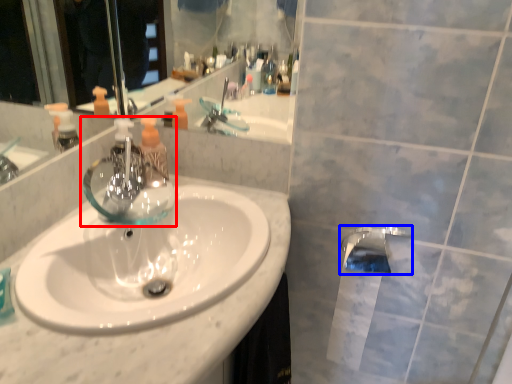
Question: Which point is further to the camera, tap (highlighted by a red box) or tap (highlighted by a blue box)?

Choices:
 (A) tap
 (B) tap

Answer: (B)